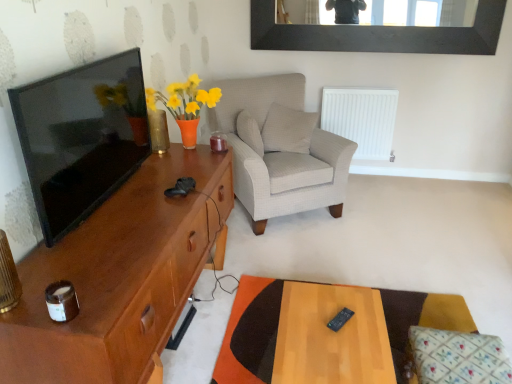
This screenshot has width=512, height=384. Identify the location of free space in front of light gray fabric armchair at center. (313, 254).